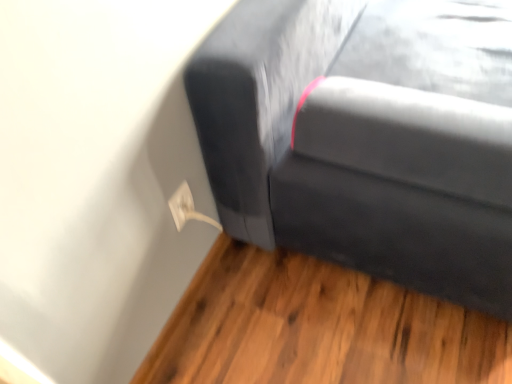
Question: From a real-world perspective, is white plastic electric outlet at lower left positioned under matte black couch at upper right based on gravity?

Choices:
 (A) yes
 (B) no

Answer: (B)

Question: From the image's perspective, does white plastic electric outlet at lower left appear lower than matte black couch at upper right?

Choices:
 (A) yes
 (B) no

Answer: (B)

Question: Does white plastic electric outlet at lower left have a smaller size compared to matte black couch at upper right?

Choices:
 (A) yes
 (B) no

Answer: (A)

Question: Considering the relative positions of white plastic electric outlet at lower left and matte black couch at upper right in the image provided, is white plastic electric outlet at lower left to the left of matte black couch at upper right from the viewer's perspective?

Choices:
 (A) yes
 (B) no

Answer: (A)

Question: Is white plastic electric outlet at lower left at the right side of matte black couch at upper right?

Choices:
 (A) yes
 (B) no

Answer: (B)

Question: Is white plastic electric outlet at lower left oriented away from matte black couch at upper right?

Choices:
 (A) no
 (B) yes

Answer: (A)

Question: Does matte black couch at upper right have a lesser height compared to white plastic electric outlet at lower left?

Choices:
 (A) no
 (B) yes

Answer: (B)

Question: From a real-world perspective, is matte black couch at upper right positioned under white plastic electric outlet at lower left based on gravity?

Choices:
 (A) yes
 (B) no

Answer: (A)

Question: Does matte black couch at upper right turn towards white plastic electric outlet at lower left?

Choices:
 (A) no
 (B) yes

Answer: (A)

Question: From the image's perspective, would you say matte black couch at upper right is shown under white plastic electric outlet at lower left?

Choices:
 (A) yes
 (B) no

Answer: (A)

Question: Is matte black couch at upper right positioned beyond the bounds of white plastic electric outlet at lower left?

Choices:
 (A) no
 (B) yes

Answer: (B)

Question: Is white plastic electric outlet at lower left at the back of matte black couch at upper right?

Choices:
 (A) no
 (B) yes

Answer: (A)

Question: Is matte black couch at upper right wider or thinner than white plastic electric outlet at lower left?

Choices:
 (A) wide
 (B) thin

Answer: (A)